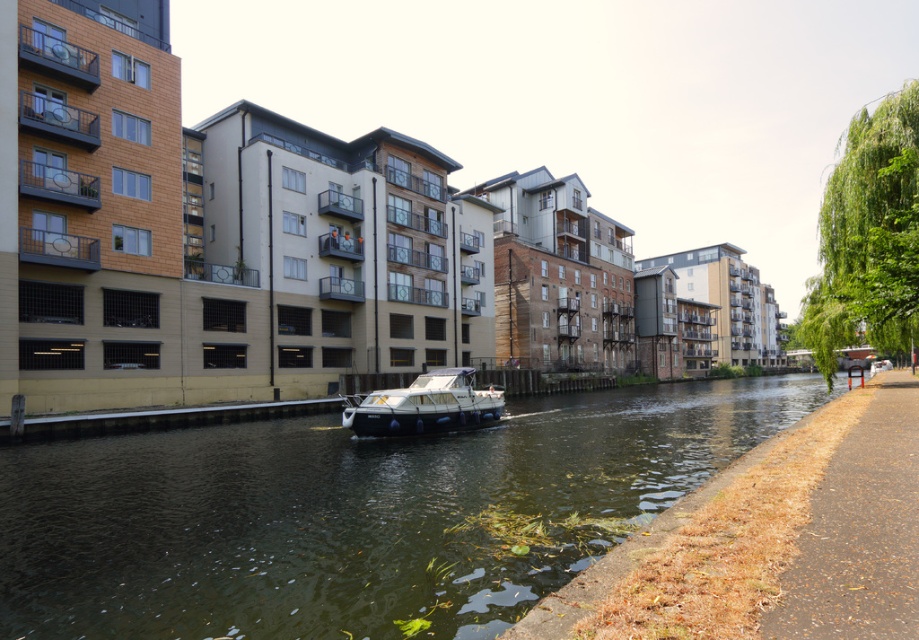
From the picture: You are a tourist standing on the paved path on the right side of the canal. You see the greenish water at center and the white glossy boat at center. Which object is closer to your current position?

The greenish water at center is located below the white glossy boat at center, so the white glossy boat at center is closer to your position on the paved path since it is positioned above the water.

From the picture: You are a tourist standing on the paved path on the right side of the canal. You see the greenish water at center and the white glossy boat at center. Which object is closer to your left side?

The white glossy boat at center is closer to your left side because the greenish water at center is to the right of the white glossy boat at center.